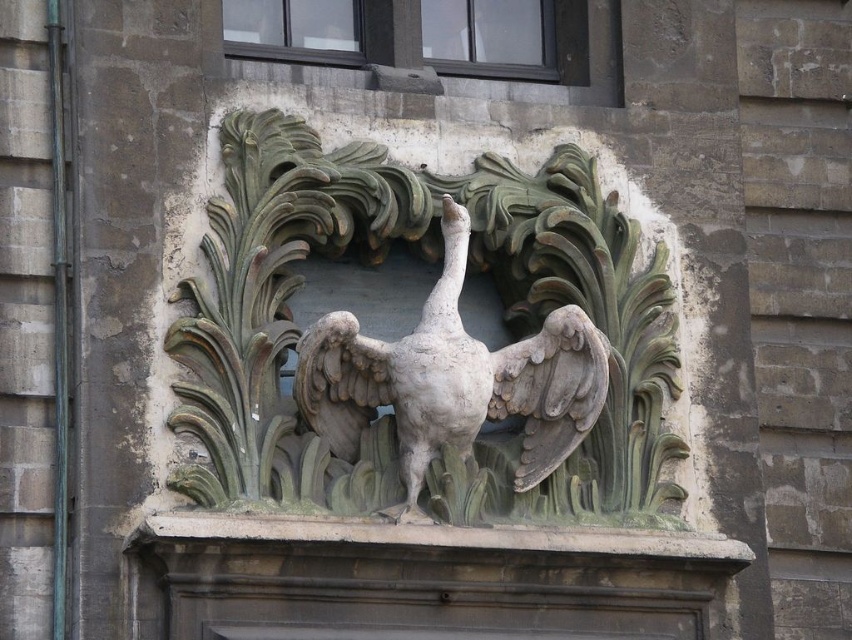
Question: Which point is closer to the camera taking this photo?

Choices:
 (A) (318, 406)
 (B) (602, 355)

Answer: (A)

Question: Is matte stone bird at center wider than gray stone bird at center?

Choices:
 (A) yes
 (B) no

Answer: (A)

Question: Does matte stone bird at center have a larger size compared to gray stone bird at center?

Choices:
 (A) no
 (B) yes

Answer: (B)

Question: Does matte stone bird at center appear under gray stone bird at center?

Choices:
 (A) no
 (B) yes

Answer: (A)